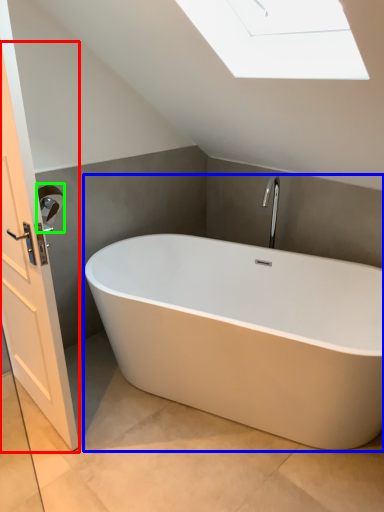
Question: Which is nearer to the screen door (highlighted by a red box)? bathtub (highlighted by a blue box) or towel bar (highlighted by a green box).

Choices:
 (A) bathtub
 (B) towel bar

Answer: (B)